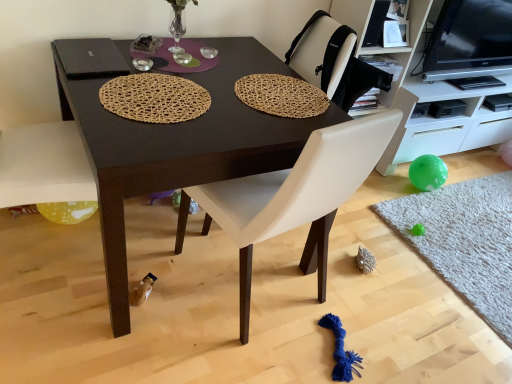
Where is `free space to the back side of woven natural mat at upper center, the 1th mat when ordered from top to bottom`? This screenshot has height=384, width=512. free space to the back side of woven natural mat at upper center, the 1th mat when ordered from top to bottom is located at coordinates (251, 57).